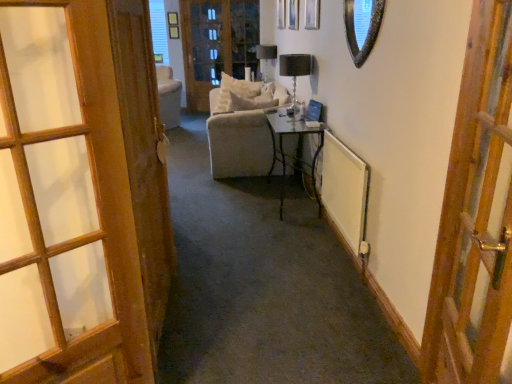
Question: Is clear glass table at center at the right side of wooden door at left, which appears as the second door when viewed from the left?

Choices:
 (A) no
 (B) yes

Answer: (B)

Question: Can you confirm if clear glass table at center is shorter than wooden door at left, which is counted as the second door, starting from the right?

Choices:
 (A) no
 (B) yes

Answer: (B)

Question: Is clear glass table at center next to wooden door at left, which appears as the second door when viewed from the left, and touching it?

Choices:
 (A) yes
 (B) no

Answer: (B)

Question: Is clear glass table at center thinner than wooden door at left, which appears as the second door when viewed from the left?

Choices:
 (A) yes
 (B) no

Answer: (B)

Question: Considering the relative sizes of clear glass table at center and wooden door at left, which is counted as the second door, starting from the right, in the image provided, is clear glass table at center wider than wooden door at left, which is counted as the second door, starting from the right,?

Choices:
 (A) yes
 (B) no

Answer: (A)

Question: Is clear glass table at center not near wooden door at left, which appears as the second door when viewed from the left?

Choices:
 (A) no
 (B) yes

Answer: (B)

Question: Considering the relative positions of shiny silver mirror at upper right and wooden door at left, which appears as the second door when viewed from the left, in the image provided, is shiny silver mirror at upper right behind wooden door at left, which appears as the second door when viewed from the left,?

Choices:
 (A) no
 (B) yes

Answer: (B)

Question: Is shiny silver mirror at upper right facing away from wooden door at left, which is counted as the second door, starting from the right?

Choices:
 (A) yes
 (B) no

Answer: (B)

Question: Is shiny silver mirror at upper right with wooden door at left, which is counted as the second door, starting from the right?

Choices:
 (A) no
 (B) yes

Answer: (A)

Question: From a real-world perspective, is shiny silver mirror at upper right located higher than wooden door at left, which appears as the second door when viewed from the left?

Choices:
 (A) yes
 (B) no

Answer: (A)

Question: Is shiny silver mirror at upper right bigger than wooden door at left, which is counted as the second door, starting from the right?

Choices:
 (A) no
 (B) yes

Answer: (A)

Question: Is shiny silver mirror at upper right thinner than wooden door at left, which is counted as the second door, starting from the right?

Choices:
 (A) no
 (B) yes

Answer: (A)

Question: Is wooden door at left, which is counted as the second door, starting from the right, positioned beyond the bounds of matte black table lamp at upper center, which is the 1th table lamp from top to bottom?

Choices:
 (A) yes
 (B) no

Answer: (A)